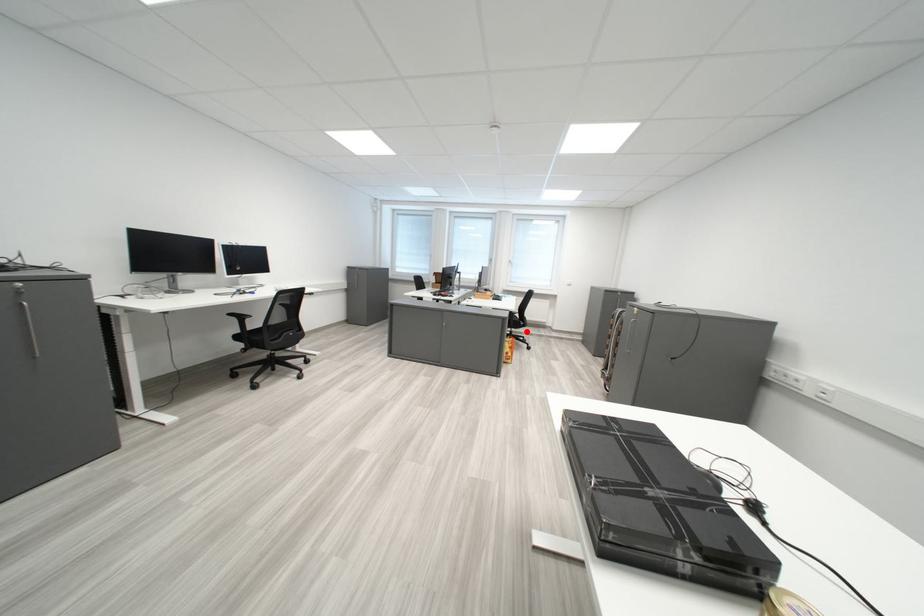
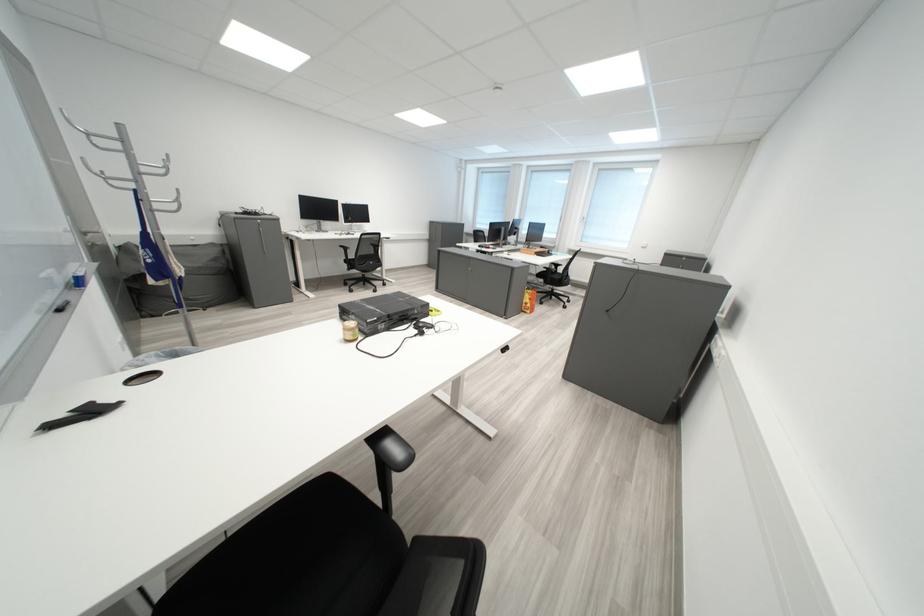
Locate, in the second image, the point that corresponds to the highlighted location in the first image.

(567, 290)